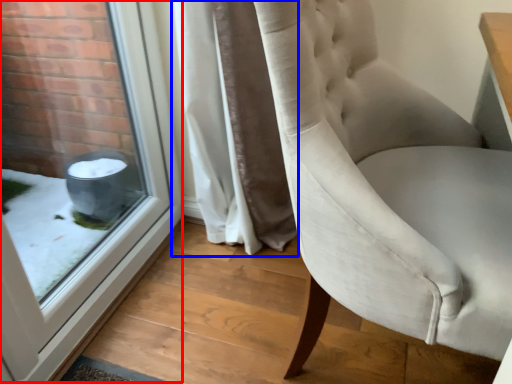
Question: Which point is closer to the camera, window (highlighted by a red box) or curtain (highlighted by a blue box)?

Choices:
 (A) window
 (B) curtain

Answer: (A)